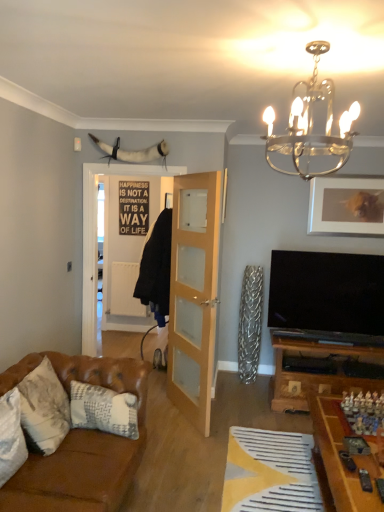
Identify the location of empty space that is ontop of yellow fabric at lower center (from a real-world perspective). Image resolution: width=384 pixels, height=512 pixels. (271, 470).